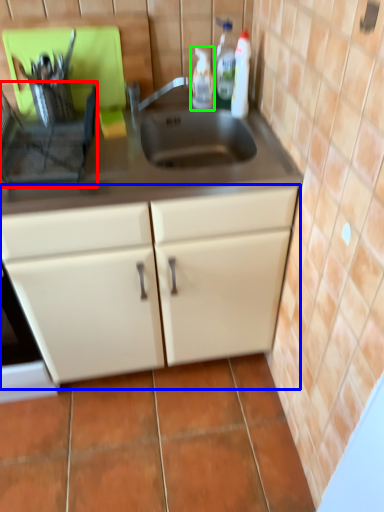
Question: Which object is positioned closest to appliance (highlighted by a red box)? Select from cabinetry (highlighted by a blue box) and bottle (highlighted by a green box).

Choices:
 (A) cabinetry
 (B) bottle

Answer: (A)